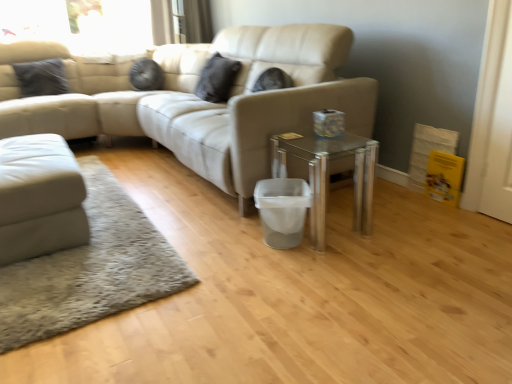
Question: From a real-world perspective, relative to matte black pillow at upper center, marked as the first pillow in a right-to-left arrangement, is black matte pillow at upper left, the 2th pillow in the right-to-left sequence, vertically above or below?

Choices:
 (A) above
 (B) below

Answer: (B)

Question: Which is correct: black matte pillow at upper left, which appears as the 1th pillow when viewed from the left, is inside matte black pillow at upper center, the 2th pillow in the left-to-right sequence, or outside of it?

Choices:
 (A) outside
 (B) inside

Answer: (A)

Question: Which of these objects is positioned farthest from the black matte pillow at upper left, which appears as the 1th pillow when viewed from the left?

Choices:
 (A) beige leather couch at center, positioned as the first studio couch in right-to-left order
 (B) transparent glass table at center
 (C) white leather ottoman at lower left, which ranks as the second studio couch in right-to-left order
 (D) matte black pillow at upper center, the 2th pillow in the left-to-right sequence
 (E) white wood screen door at right

Answer: (E)

Question: Estimate the real-world distances between objects in this image. Which object is farther from the white leather ottoman at lower left, which ranks as the second studio couch in right-to-left order?

Choices:
 (A) beige leather couch at center, positioned as the first studio couch in right-to-left order
 (B) black matte pillow at upper left, which appears as the 1th pillow when viewed from the left
 (C) transparent glass table at center
 (D) matte black pillow at upper center, marked as the first pillow in a right-to-left arrangement
 (E) white wood screen door at right

Answer: (E)